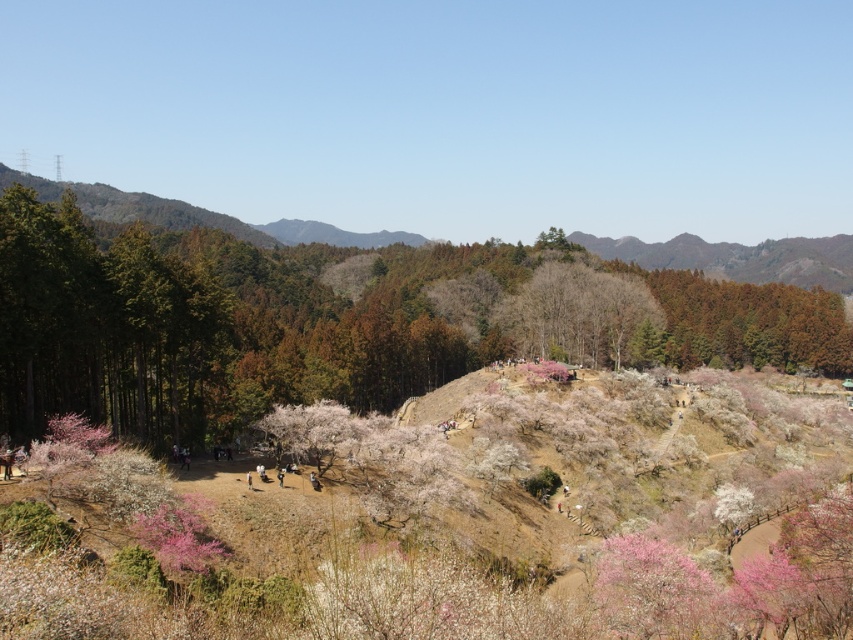
You are planning to install a new walking path that connects the pink blossoms at center to the green leafy forest at left. What is the minimum length of the path required to connect these two areas?

The minimum length of the path required to connect the pink blossoms at center to the green leafy forest at left is 740.92 feet, as this is the direct distance between them.

You are planning to take a photo of the pink blossoms at center and the green leafy forest at left. Which object should you focus on first if you want to capture both in a single frame without moving the camera?

You should focus on the green leafy forest at left first because it is larger in size compared to the pink blossoms at center, ensuring it stays in focus while the smaller blossoms can be included in the frame as well.